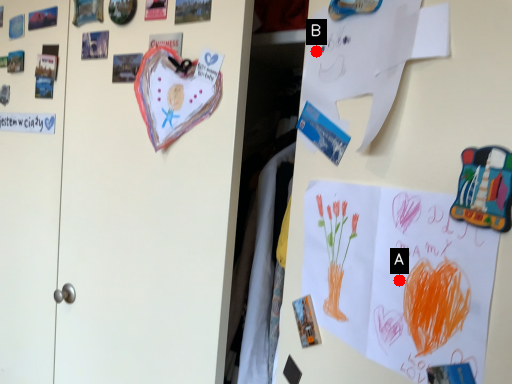
Question: Two points are circled on the image, labeled by A and B beside each circle. Which point is farther to the camera?

Choices:
 (A) A is further
 (B) B is further

Answer: (B)